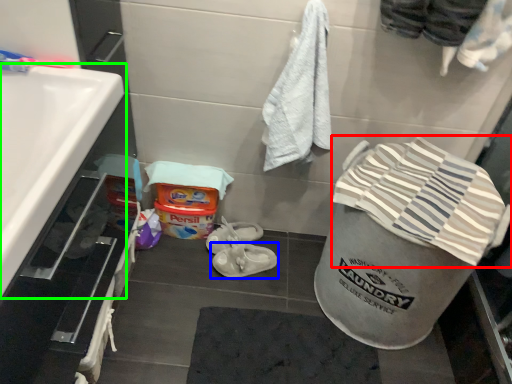
Question: Based on their relative distances, which object is nearer to beach towel (highlighted by a red box)? Choose from footwear (highlighted by a blue box) and sink (highlighted by a green box).

Choices:
 (A) footwear
 (B) sink

Answer: (A)